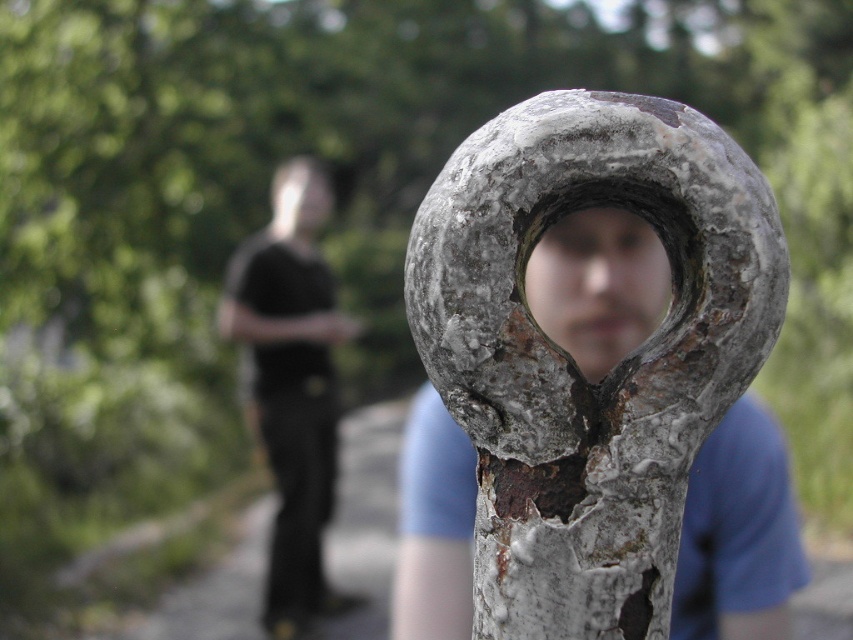
Question: Estimate the real-world distances between objects in this image. Which object is closer to the rusty metal heart at center?

Choices:
 (A) black matte shirt at center
 (B) rusty metal hole at center

Answer: (B)

Question: Is rusty metal heart at center to the left of black matte shirt at center from the viewer's perspective?

Choices:
 (A) no
 (B) yes

Answer: (A)

Question: Which point is farther to the camera?

Choices:
 (A) black matte shirt at center
 (B) rusty metal hole at center
 (C) rusty metal heart at center

Answer: (A)

Question: Considering the real-world distances, which object is farthest from the black matte shirt at center?

Choices:
 (A) rusty metal heart at center
 (B) rusty metal hole at center

Answer: (B)

Question: Does rusty metal heart at center appear under black matte shirt at center?

Choices:
 (A) no
 (B) yes

Answer: (A)

Question: Is rusty metal heart at center thinner than black matte shirt at center?

Choices:
 (A) no
 (B) yes

Answer: (A)